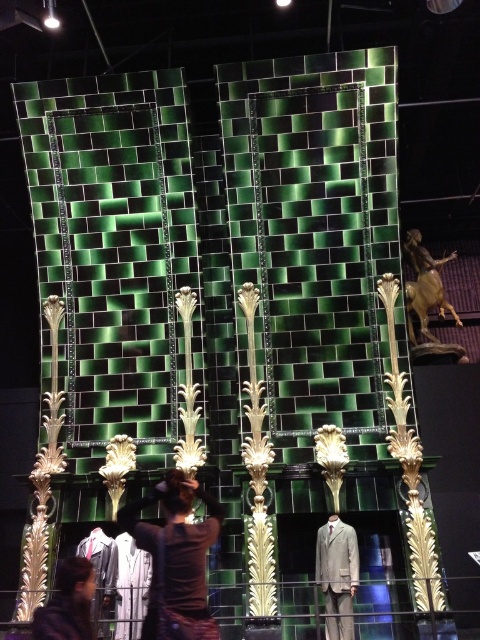
Question: Can you confirm if brown fabric at center is smaller than matte gray suit at center?

Choices:
 (A) no
 (B) yes

Answer: (A)

Question: Based on their relative distances, which object is nearer to the matte gray suit at center?

Choices:
 (A) dark brown leather jacket at lower left
 (B) brown fabric at center

Answer: (B)

Question: Considering the real-world distances, which object is farthest from the matte gray suit at center?

Choices:
 (A) brown fabric at center
 (B) dark brown leather jacket at lower left

Answer: (B)

Question: Is brown fabric at center to the right of dark brown leather jacket at lower left from the viewer's perspective?

Choices:
 (A) no
 (B) yes

Answer: (B)

Question: Which point is closer to the camera?

Choices:
 (A) (186, 538)
 (B) (73, 557)
 (C) (332, 570)

Answer: (A)

Question: Is brown fabric at center closer to the viewer compared to matte gray suit at center?

Choices:
 (A) no
 (B) yes

Answer: (B)